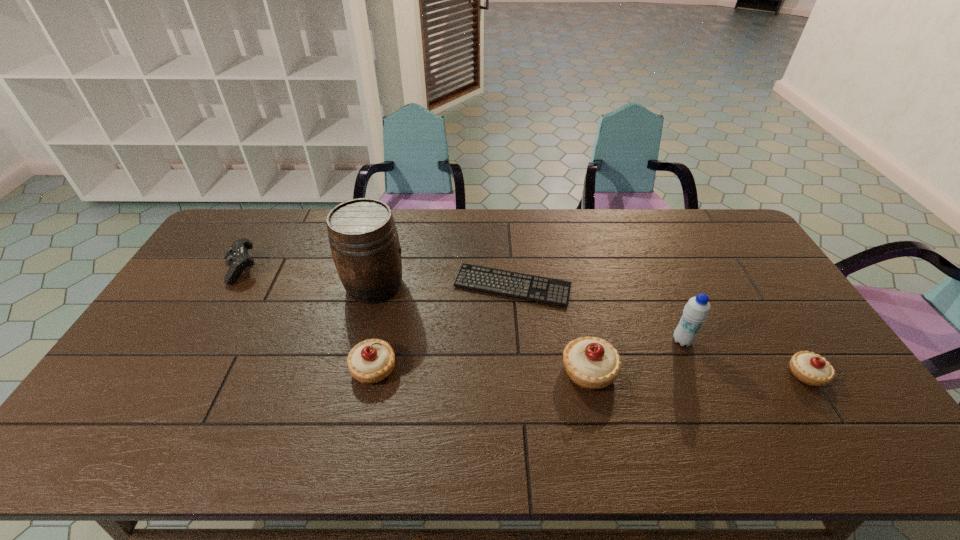
The height and width of the screenshot is (540, 960). I want to click on free point that keeps the pastrys evenly spaced on the left, so click(161, 365).